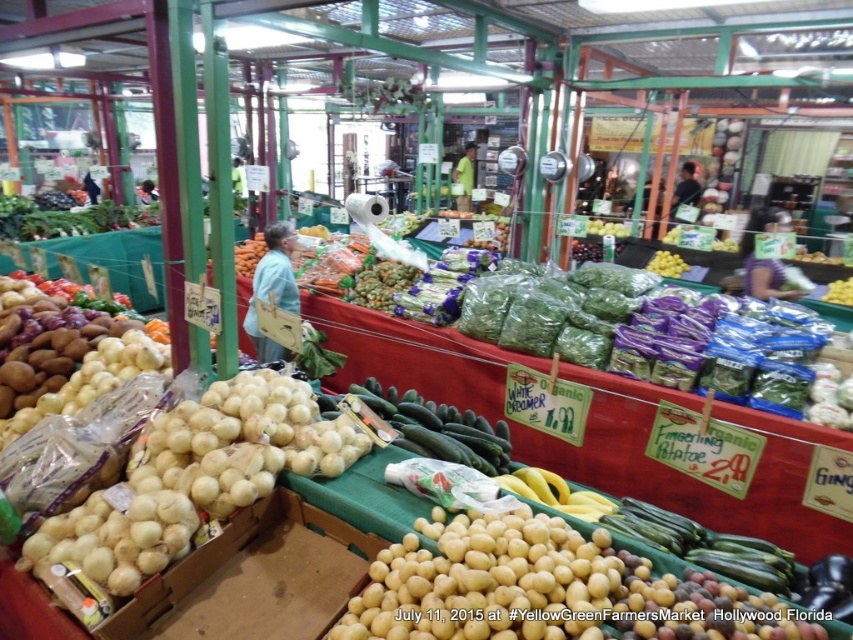
Question: Which of the following is the farthest from the observer?

Choices:
 (A) (405, 403)
 (B) (659, 272)

Answer: (B)

Question: Does green matte cucumber at center have a lesser width compared to yellow matte/yellowish-green at center?

Choices:
 (A) no
 (B) yes

Answer: (A)

Question: Does green matte cucumber at center appear on the left side of yellow matte/yellowish-green at center?

Choices:
 (A) no
 (B) yes

Answer: (B)

Question: Does green matte cucumber at center have a greater width compared to yellow matte/yellowish-green at center?

Choices:
 (A) yes
 (B) no

Answer: (A)

Question: Which point is farther to the camera?

Choices:
 (A) yellow matte/yellowish-green at center
 (B) green matte cucumber at center

Answer: (A)

Question: Which point is closer to the camera?

Choices:
 (A) (674, 269)
 (B) (488, 442)

Answer: (B)